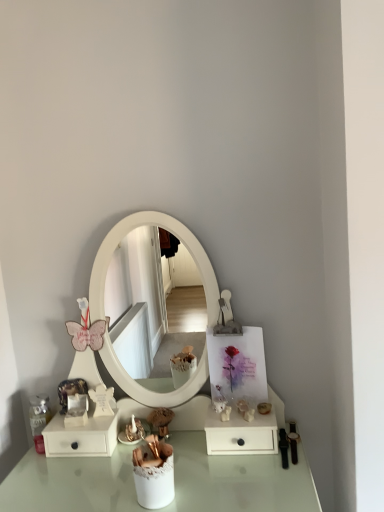
Question: Does matte gold figurine at lower center come in front of white matte drawer at lower left, positioned as the 1th dresser in left-to-right order?

Choices:
 (A) no
 (B) yes

Answer: (A)

Question: Can you confirm if matte gold figurine at lower center is bigger than white matte drawer at lower left, positioned as the 2th dresser in right-to-left order?

Choices:
 (A) yes
 (B) no

Answer: (B)

Question: Is matte gold figurine at lower center oriented towards white matte drawer at lower left, positioned as the 2th dresser in right-to-left order?

Choices:
 (A) yes
 (B) no

Answer: (B)

Question: Can you confirm if matte gold figurine at lower center is positioned to the right of white matte drawer at lower left, positioned as the 2th dresser in right-to-left order?

Choices:
 (A) no
 (B) yes

Answer: (B)

Question: From a real-world perspective, is matte gold figurine at lower center under white matte drawer at lower left, positioned as the 2th dresser in right-to-left order?

Choices:
 (A) no
 (B) yes

Answer: (B)

Question: Visually, is white matte drawer at lower left, positioned as the 1th dresser in left-to-right order, positioned to the left or to the right of matte gold figurine at lower center?

Choices:
 (A) right
 (B) left

Answer: (B)

Question: From the image's perspective, is white matte drawer at lower left, positioned as the 1th dresser in left-to-right order, above or below matte gold figurine at lower center?

Choices:
 (A) above
 (B) below

Answer: (B)

Question: From a real-world perspective, relative to matte gold figurine at lower center, is white matte drawer at lower left, positioned as the 1th dresser in left-to-right order, vertically above or below?

Choices:
 (A) above
 (B) below

Answer: (A)

Question: In terms of width, does white matte drawer at lower left, positioned as the 1th dresser in left-to-right order, look wider or thinner when compared to matte gold figurine at lower center?

Choices:
 (A) thin
 (B) wide

Answer: (B)

Question: Looking at the image, does white matte drawer at lower right, placed as the second dresser when sorted from left to right, seem bigger or smaller compared to matte gold figurine at lower center?

Choices:
 (A) small
 (B) big

Answer: (B)

Question: In the image, is white matte drawer at lower right, placed as the second dresser when sorted from left to right, on the left side or the right side of matte gold figurine at lower center?

Choices:
 (A) left
 (B) right

Answer: (B)

Question: Is point (266, 450) positioned closer to the camera than point (158, 417)?

Choices:
 (A) closer
 (B) farther

Answer: (A)

Question: Is white matte drawer at lower right, placed as the second dresser when sorted from left to right, wider or thinner than matte gold figurine at lower center?

Choices:
 (A) thin
 (B) wide

Answer: (B)

Question: Do you think matte gold figurine at lower center is within white matte drawer at lower left, positioned as the 2th dresser in right-to-left order, or outside of it?

Choices:
 (A) inside
 (B) outside

Answer: (B)

Question: In terms of height, does matte gold figurine at lower center look taller or shorter compared to white matte drawer at lower left, positioned as the 1th dresser in left-to-right order?

Choices:
 (A) short
 (B) tall

Answer: (B)